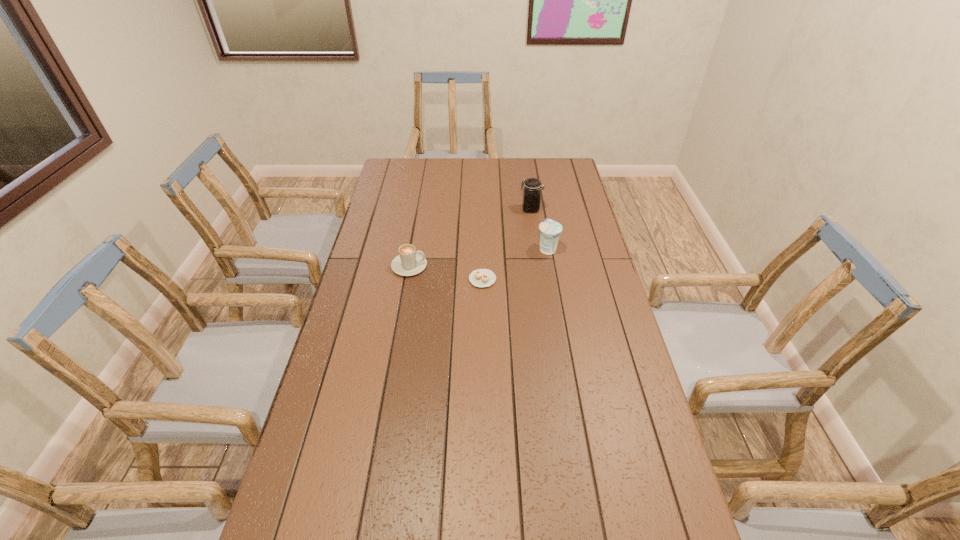
Point out which object is positioned as the third nearest to the tallest object. Please provide its 2D coordinates. Your answer should be formatted as a tuple, i.e. [(x, y)], where the tuple contains the x and y coordinates of a point satisfying the conditions above.

[(409, 262)]

At what (x,y) coordinates should I click in order to perform the action: click on vacant region that satisfies the following two spatial constraints: 1. on the lid of the second tallest object; 2. on the right side of the tallest object. Please return your answer as a coordinate pair (x, y). Image resolution: width=960 pixels, height=540 pixels. Looking at the image, I should click on (537, 249).

Locate an element on the screen. This screenshot has width=960, height=540. free location that satisfies the following two spatial constraints: 1. on the lid of the jar; 2. on the left side of the second tallest object is located at coordinates (537, 249).

Locate an element on the screen. This screenshot has width=960, height=540. vacant area that satisfies the following two spatial constraints: 1. on the front side of the yogurt; 2. to the right of the cappuccino is located at coordinates (551, 266).

Where is `blank space that satisfies the following two spatial constraints: 1. to the right of the cupcake; 2. on the left side of the third tallest object`? Image resolution: width=960 pixels, height=540 pixels. blank space that satisfies the following two spatial constraints: 1. to the right of the cupcake; 2. on the left side of the third tallest object is located at coordinates (407, 280).